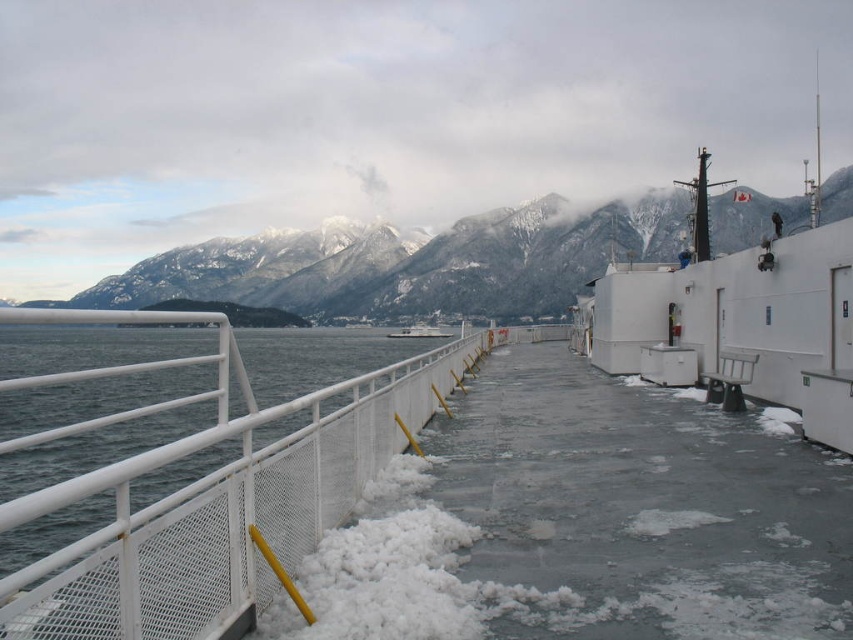
Question: Does snowy mountain at upper center have a larger size compared to white matte boat at center?

Choices:
 (A) no
 (B) yes

Answer: (B)

Question: Does white ice at left appear on the left side of white matte boat at center?

Choices:
 (A) yes
 (B) no

Answer: (A)

Question: Is snowy mountain at upper center behind white matte boat at center?

Choices:
 (A) yes
 (B) no

Answer: (B)

Question: Among these objects, which one is nearest to the camera?

Choices:
 (A) white ice at left
 (B) white matte boat at center
 (C) snowy mountain at upper center

Answer: (A)

Question: Which point is closer to the camera taking this photo?

Choices:
 (A) 289,552
 (B) 425,328
 (C) 251,246

Answer: (A)

Question: Which point appears closest to the camera in this image?

Choices:
 (A) [425, 337]
 (B) [300, 273]
 (C) [305, 513]

Answer: (C)